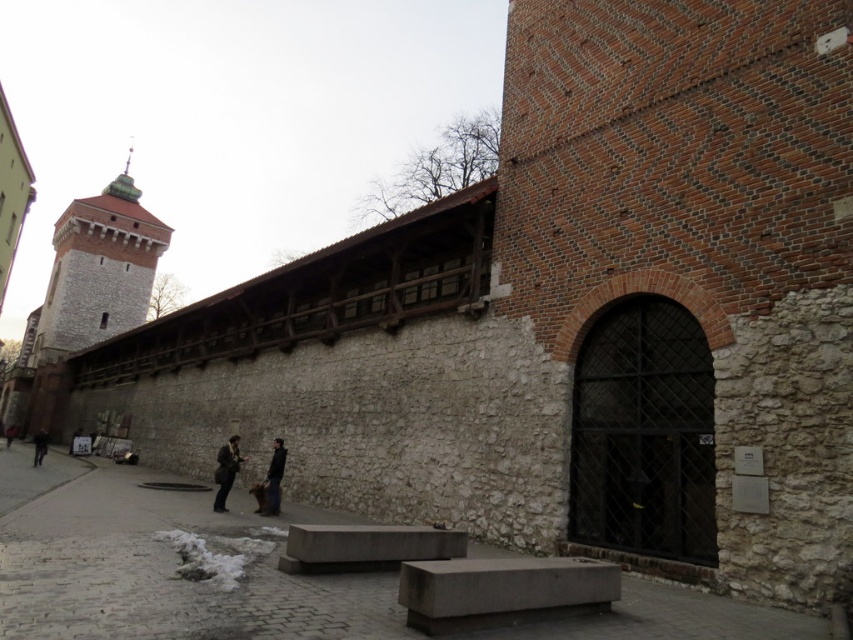
Question: Estimate the real-world distances between objects in this image. Which object is farther from the black leather jacket at center?

Choices:
 (A) gray concrete bench at center
 (B) gray stone tower at upper left
 (C) dark brown leather jacket at lower center

Answer: (B)

Question: Which object is positioned farthest from the gray concrete bench at center?

Choices:
 (A) dark gray jacket at lower left
 (B) gray stone tower at upper left

Answer: (B)

Question: Does gray stone tower at upper left appear over dark brown leather jacket at lower center?

Choices:
 (A) yes
 (B) no

Answer: (A)

Question: Estimate the real-world distances between objects in this image. Which object is farther from the dark gray jacket at lower left?

Choices:
 (A) gray concrete bench at center
 (B) black leather jacket at center
 (C) gray stone tower at upper left

Answer: (C)

Question: Is gray stone tower at upper left bigger than black leather jacket at center?

Choices:
 (A) no
 (B) yes

Answer: (B)

Question: Can you confirm if dark brown leather jacket at lower center is smaller than dark gray jacket at lower left?

Choices:
 (A) yes
 (B) no

Answer: (A)